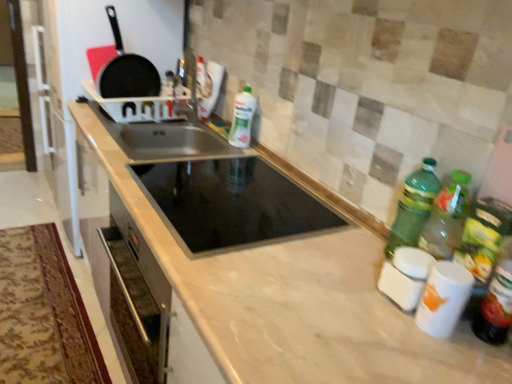
Where is `free space to the left of green plastic bottle at right, marked as the 2th bottle in a back-to-front arrangement`? The height and width of the screenshot is (384, 512). free space to the left of green plastic bottle at right, marked as the 2th bottle in a back-to-front arrangement is located at coordinates pyautogui.click(x=334, y=247).